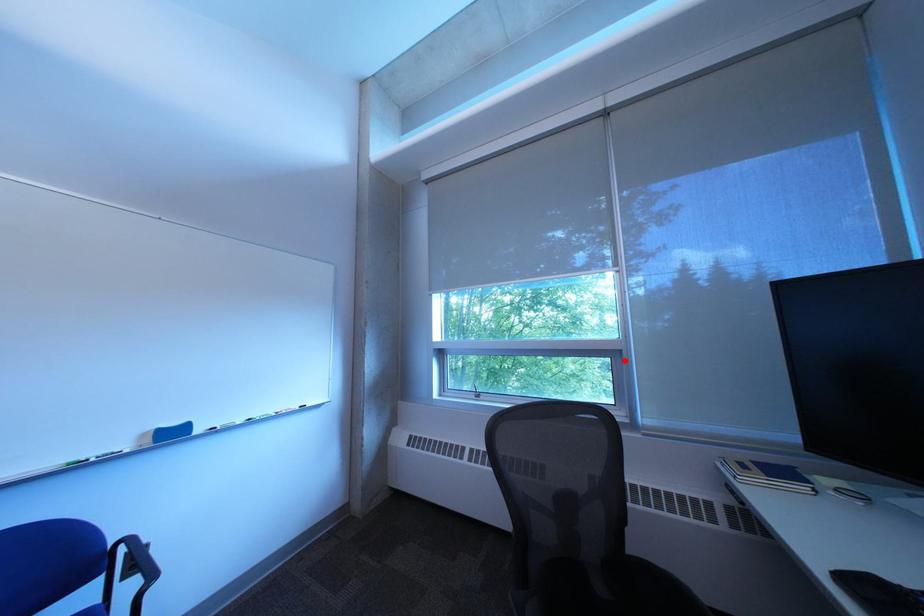
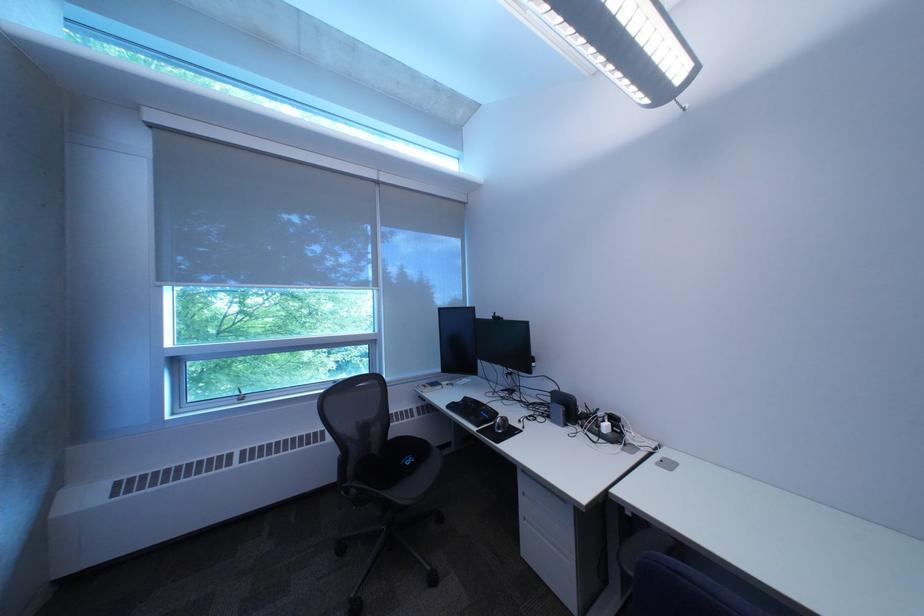
The point at the highlighted location is marked in the first image. Where is the corresponding point in the second image?

(383, 347)